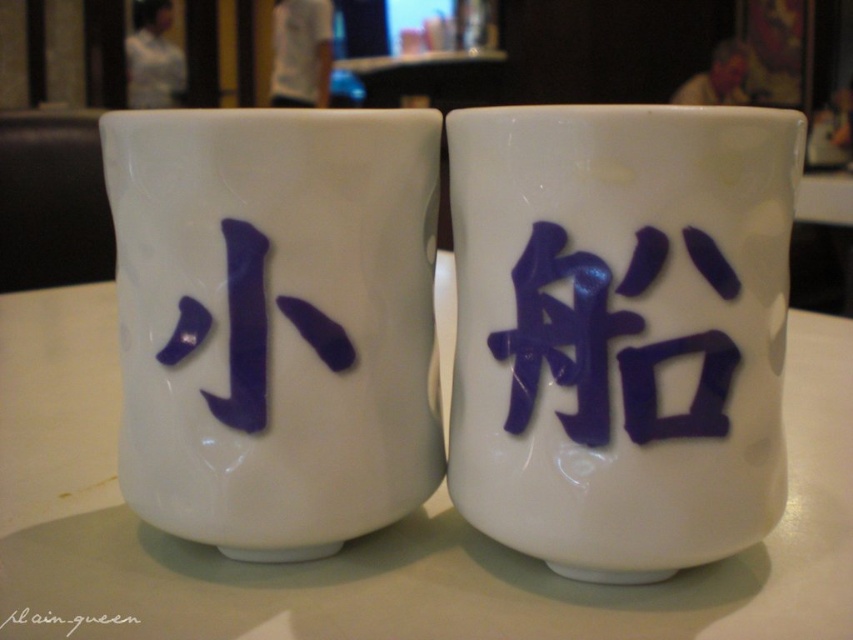
Who is more distant from viewer, (664, 246) or (20, 452)?

Point (20, 452)

Which is above, glossy ceramic mug at upper center or white glossy table at center?

glossy ceramic mug at upper center

Find the location of a particular element. glossy ceramic mug at upper center is located at coordinates [619, 330].

Is point (97, 397) closer to camera compared to point (57, 628)?

That is False.

Can you confirm if white glossy table at center is taller than black ink signature at center?

Yes.

Does point (1, 432) come closer to viewer compared to point (38, 614)?

No, it is behind (38, 614).

Where is `white glossy table at center`? The height and width of the screenshot is (640, 853). white glossy table at center is located at coordinates (384, 529).

Who is shorter, glossy ceramic mug at upper center or black ink signature at center?

black ink signature at center

How far apart are glossy ceramic mug at upper center and black ink signature at center?

A distance of 21.89 inches exists between glossy ceramic mug at upper center and black ink signature at center.

Who is more forward, (x=578, y=282) or (x=90, y=624)?

Point (x=90, y=624) is more forward.

This screenshot has height=640, width=853. In order to click on glossy ceramic mug at upper center in this screenshot , I will do `click(619, 330)`.